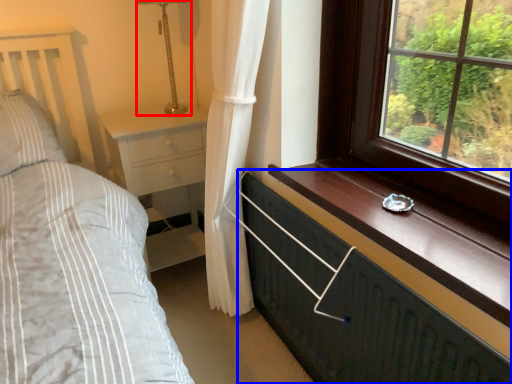
Question: Which point is closer to the camera, table lamp (highlighted by a red box) or chest of drawers (highlighted by a blue box)?

Choices:
 (A) table lamp
 (B) chest of drawers

Answer: (B)